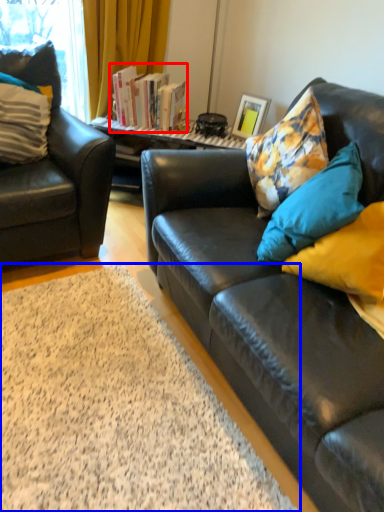
Question: Which of the following is the farthest to the observer, book (highlighted by a red box) or plain (highlighted by a blue box)?

Choices:
 (A) book
 (B) plain

Answer: (A)